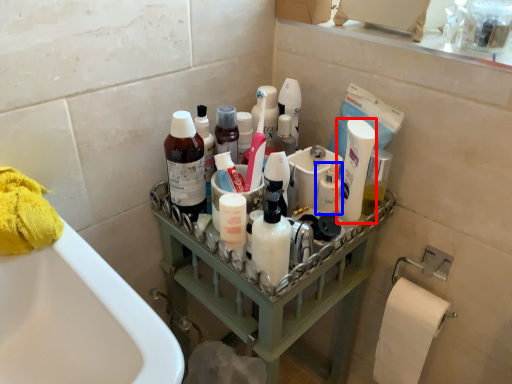
Question: Among these objects, which one is farthest to the camera, mouthwash (highlighted by a red box) or toiletry (highlighted by a blue box)?

Choices:
 (A) mouthwash
 (B) toiletry

Answer: (B)